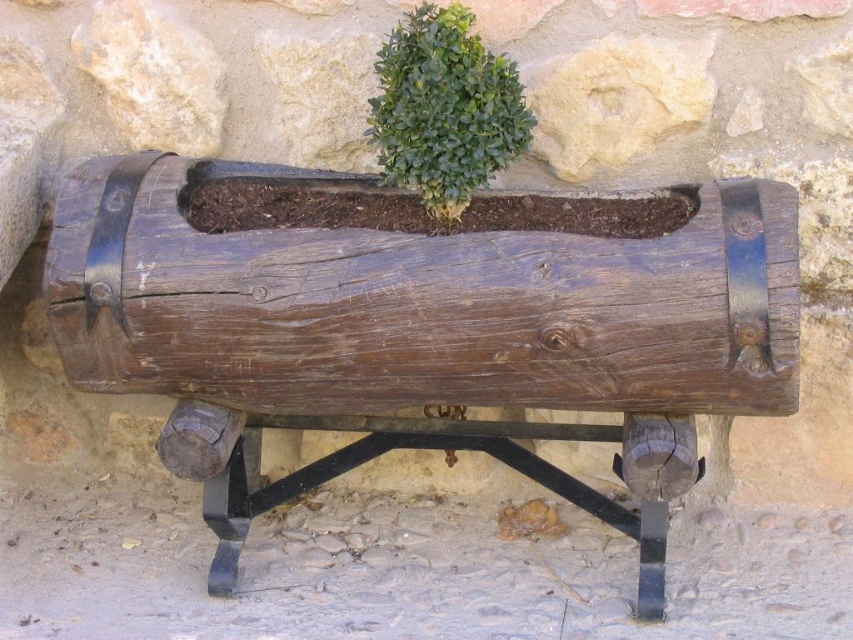
Question: Does rustic wood planter at center have a smaller size compared to green leafy bush at center?

Choices:
 (A) no
 (B) yes

Answer: (A)

Question: Which point is closer to the camera?

Choices:
 (A) rustic wood planter at center
 (B) green leafy bush at center

Answer: (A)

Question: Can you confirm if rustic wood planter at center is positioned to the left of green leafy bush at center?

Choices:
 (A) no
 (B) yes

Answer: (A)

Question: Can you confirm if rustic wood planter at center is thinner than green leafy bush at center?

Choices:
 (A) no
 (B) yes

Answer: (A)

Question: Among these objects, which one is farthest from the camera?

Choices:
 (A) green leafy bush at center
 (B) rustic wood planter at center

Answer: (A)